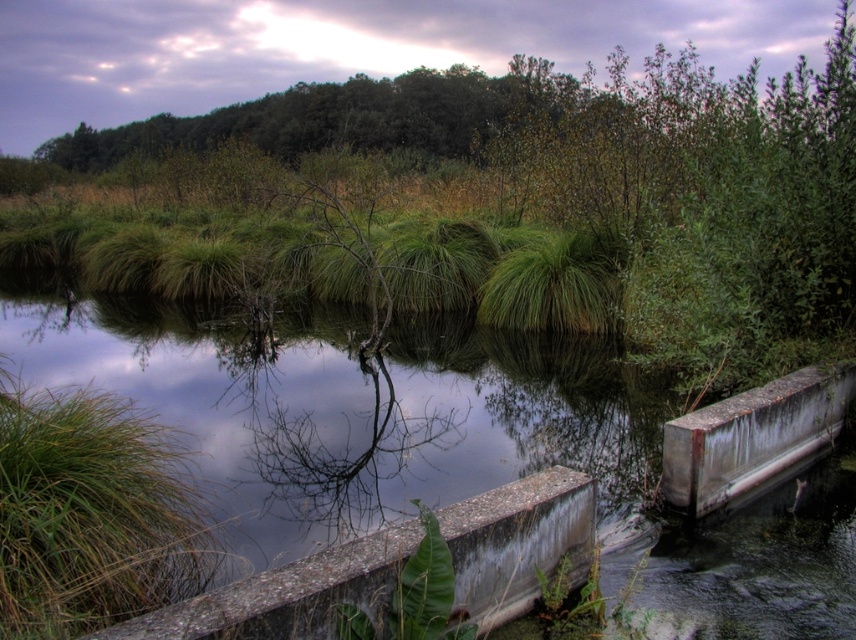
You are standing at the edge of the water and want to step onto the concrete ledge at lower center. Considering the green grass at center between you and the ledge, will you need to bend down to avoid hitting your knees?

The green grass at center is taller than the concrete ledge at lower center. Since the grass is taller, you would need to bend down to step over it and reach the concrete ledge at lower center without hitting your knees.

You are standing at the edge of the water and want to step onto the concrete ledge at lower center. What direction should you move relative to the green grass at center to reach it?

The green grass at center is above the concrete ledge at lower center, so you should move downward from the green grass at center to reach the concrete ledge at lower center.